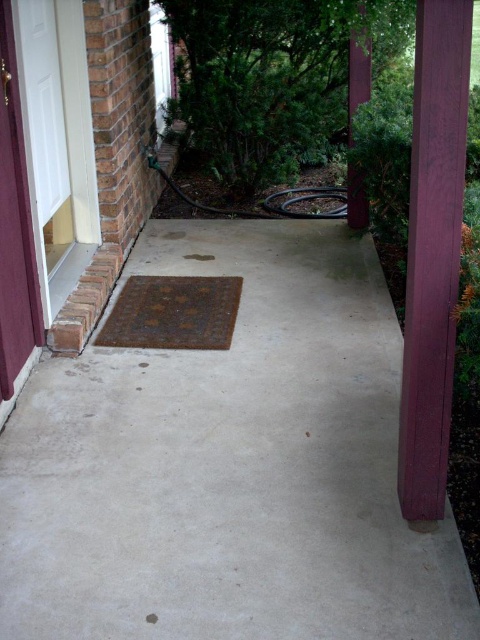
You are a delivery person with a package that is 1.6 meters long. You need to place it between the purple wood post at right and the rusty metal doormat at center. Is there enough space to fit the package horizontally?

The distance between the purple wood post at right and the rusty metal doormat at center is 1.57 meters. Since the package is 1.6 meters long, it is slightly longer than the available space. Therefore, the package cannot fit horizontally between them.

You are a painter who needs to choose the right brush for the job. You have two purple wood posts to paint on the porch. The purple wood post at right and the purple wood post at upper right. Which post requires a wider brush to cover its surface?

The purple wood post at right requires a wider brush because its width is larger than the purple wood post at upper right.